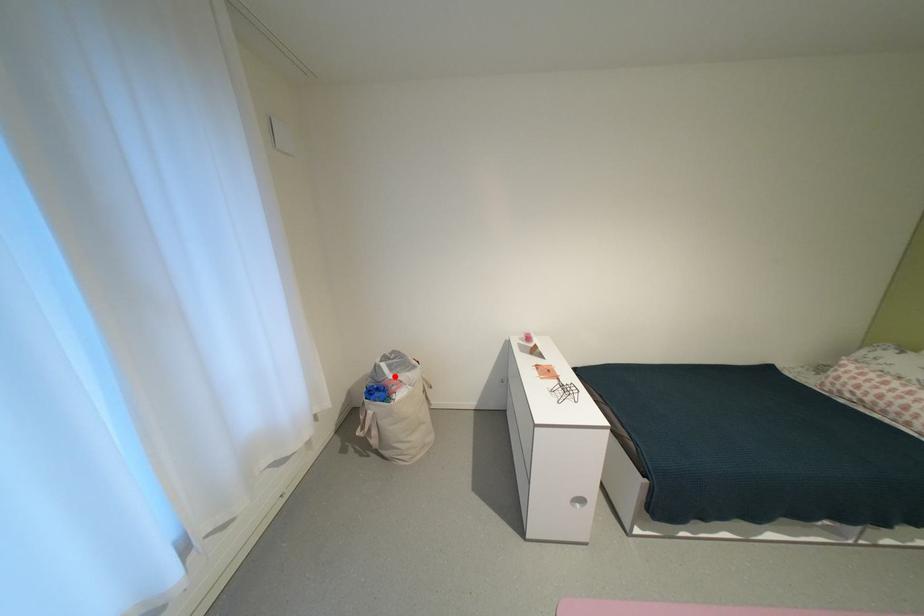
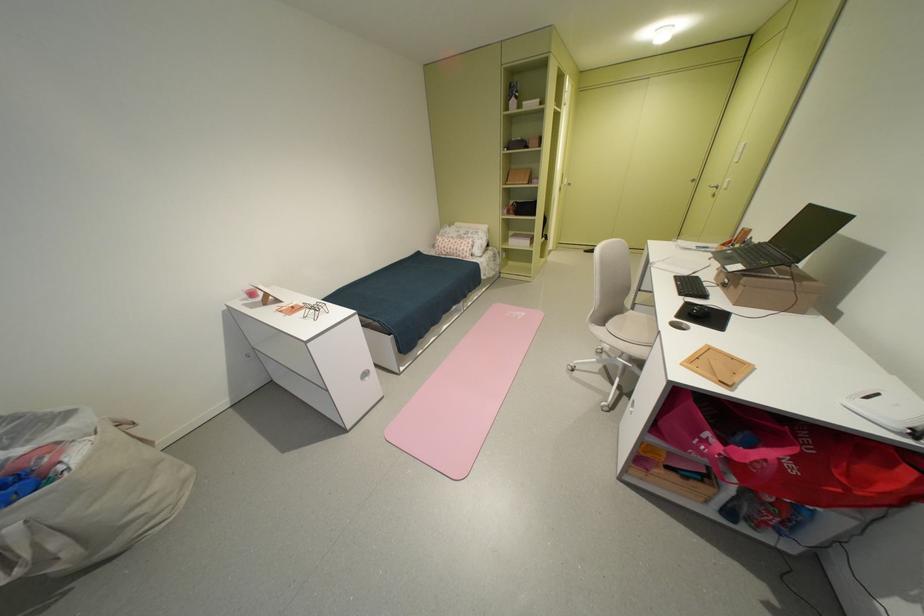
In the second image, find the point that corresponds to the highlighted location in the first image.

(6, 463)